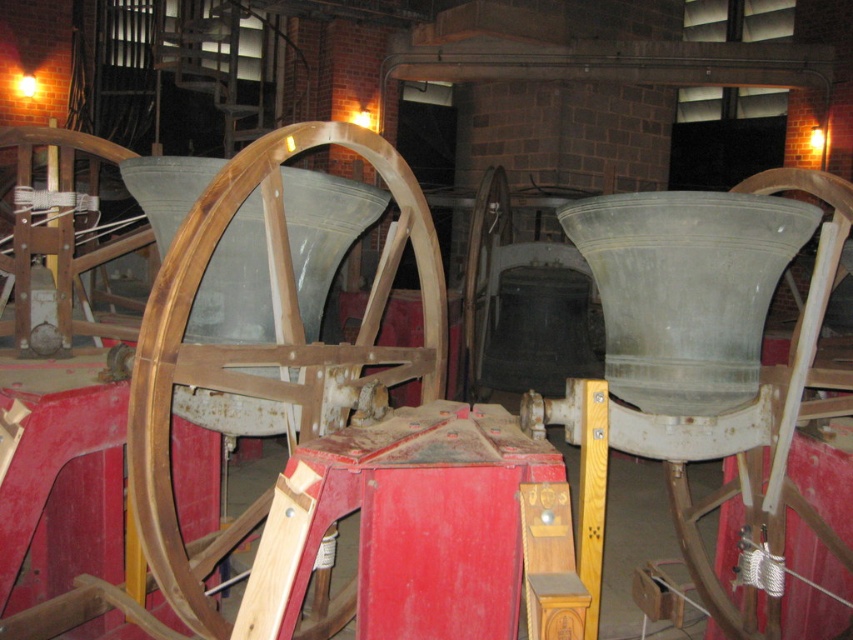
Between metallic gray bell at center and wooden at center, which one appears on the left side from the viewer's perspective?

wooden at center

Which of these two, metallic gray bell at center or wooden at center, stands taller?

wooden at center

At what (x,y) coordinates should I click in order to perform the action: click on metallic gray bell at center. Please return your answer as a coordinate pair (x, y). The image size is (853, 640). Looking at the image, I should click on (776, 420).

Locate an element on the screen. The image size is (853, 640). metallic gray bell at center is located at coordinates (776, 420).

Who is higher up, wooden wheel at center or metallic gray bell at center?

wooden wheel at center

Does point (151, 324) come closer to viewer compared to point (843, 211)?

Yes, point (151, 324) is in front of point (843, 211).

This screenshot has width=853, height=640. Identify the location of wooden wheel at center. (268, 346).

You are a GUI agent. You are given a task and a screenshot of the screen. Output one action in this format:
    pyautogui.click(x=<x>, y=<y>)
    Task: Click on the wooden wheel at center
    This screenshot has height=640, width=853.
    Given the screenshot: What is the action you would take?
    pyautogui.click(x=268, y=346)

Between wooden wheel at center and wooden at center, which one appears on the left side from the viewer's perspective?

wooden wheel at center

Is wooden wheel at center bigger than wooden at center?

Actually, wooden wheel at center might be smaller than wooden at center.

You are a GUI agent. You are given a task and a screenshot of the screen. Output one action in this format:
    pyautogui.click(x=<x>, y=<y>)
    Task: Click on the wooden wheel at center
    
    Given the screenshot: What is the action you would take?
    pyautogui.click(x=268, y=346)

The height and width of the screenshot is (640, 853). Find the location of `wooden wheel at center`. wooden wheel at center is located at coordinates (268, 346).